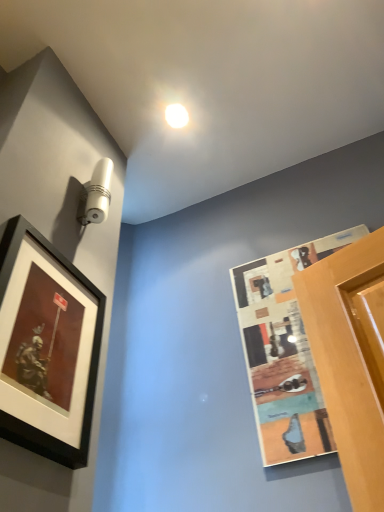
Question: Does wooden textured picture frame at right, acting as the 1th picture frame starting from the right, have a greater width compared to matte black picture frame at left, acting as the 2th picture frame starting from the right?

Choices:
 (A) yes
 (B) no

Answer: (B)

Question: Does wooden textured picture frame at right, which is the second picture frame in left-to-right order, have a greater height compared to matte black picture frame at left, which is the first picture frame from left to right?

Choices:
 (A) no
 (B) yes

Answer: (B)

Question: Does wooden textured picture frame at right, acting as the 1th picture frame starting from the right, touch matte black picture frame at left, which is the first picture frame from left to right?

Choices:
 (A) yes
 (B) no

Answer: (B)

Question: Does wooden textured picture frame at right, which is the second picture frame in left-to-right order, appear on the right side of matte black picture frame at left, acting as the 2th picture frame starting from the right?

Choices:
 (A) no
 (B) yes

Answer: (B)

Question: Is wooden textured picture frame at right, which is the second picture frame in left-to-right order, turned away from matte black picture frame at left, acting as the 2th picture frame starting from the right?

Choices:
 (A) no
 (B) yes

Answer: (A)

Question: Considering the relative positions of wooden textured picture frame at right, which is the second picture frame in left-to-right order, and white glossy droplight at upper center in the image provided, is wooden textured picture frame at right, which is the second picture frame in left-to-right order, to the left or to the right of white glossy droplight at upper center?

Choices:
 (A) right
 (B) left

Answer: (A)

Question: Is wooden textured picture frame at right, acting as the 1th picture frame starting from the right, taller or shorter than white glossy droplight at upper center?

Choices:
 (A) short
 (B) tall

Answer: (B)

Question: Is wooden textured picture frame at right, acting as the 1th picture frame starting from the right, in front of or behind white glossy droplight at upper center in the image?

Choices:
 (A) front
 (B) behind

Answer: (A)

Question: Based on their sizes in the image, would you say wooden textured picture frame at right, acting as the 1th picture frame starting from the right, is bigger or smaller than white glossy droplight at upper center?

Choices:
 (A) big
 (B) small

Answer: (A)

Question: Considering the positions of wooden textured picture frame at right, acting as the 1th picture frame starting from the right, and matte black picture frame at left, which is the first picture frame from left to right, in the image, is wooden textured picture frame at right, acting as the 1th picture frame starting from the right, taller or shorter than matte black picture frame at left, which is the first picture frame from left to right,?

Choices:
 (A) tall
 (B) short

Answer: (A)

Question: Would you say wooden textured picture frame at right, acting as the 1th picture frame starting from the right, is to the left or to the right of matte black picture frame at left, acting as the 2th picture frame starting from the right, in the picture?

Choices:
 (A) right
 (B) left

Answer: (A)

Question: In the image, is wooden textured picture frame at right, acting as the 1th picture frame starting from the right, positioned in front of or behind matte black picture frame at left, acting as the 2th picture frame starting from the right?

Choices:
 (A) behind
 (B) front

Answer: (A)

Question: Would you say wooden textured picture frame at right, acting as the 1th picture frame starting from the right, is inside or outside matte black picture frame at left, which is the first picture frame from left to right?

Choices:
 (A) inside
 (B) outside

Answer: (B)

Question: Considering the positions of matte black picture frame at left, which is the first picture frame from left to right, and wooden textured picture frame at right, which is the second picture frame in left-to-right order, in the image, is matte black picture frame at left, which is the first picture frame from left to right, taller or shorter than wooden textured picture frame at right, which is the second picture frame in left-to-right order,?

Choices:
 (A) tall
 (B) short

Answer: (B)

Question: Considering the relative positions of matte black picture frame at left, acting as the 2th picture frame starting from the right, and wooden textured picture frame at right, acting as the 1th picture frame starting from the right, in the image provided, is matte black picture frame at left, acting as the 2th picture frame starting from the right, to the left or to the right of wooden textured picture frame at right, acting as the 1th picture frame starting from the right,?

Choices:
 (A) right
 (B) left

Answer: (B)